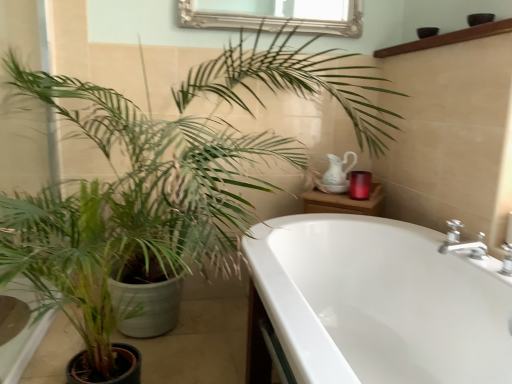
Question: Is brown wooden balustrade at upper right positioned beyond the bounds of green matte plant at left?

Choices:
 (A) no
 (B) yes

Answer: (B)

Question: Can you confirm if brown wooden balustrade at upper right is taller than green matte plant at left?

Choices:
 (A) yes
 (B) no

Answer: (B)

Question: Does brown wooden balustrade at upper right lie in front of green matte plant at left?

Choices:
 (A) no
 (B) yes

Answer: (A)

Question: Could you tell me if brown wooden balustrade at upper right is facing green matte plant at left?

Choices:
 (A) yes
 (B) no

Answer: (B)

Question: From the image's perspective, is brown wooden balustrade at upper right located above green matte plant at left?

Choices:
 (A) yes
 (B) no

Answer: (A)

Question: Is point (93, 251) positioned closer to the camera than point (328, 370)?

Choices:
 (A) farther
 (B) closer

Answer: (A)

Question: Is green matte plant at left wider or thinner than white glossy bathtub at lower right?

Choices:
 (A) wide
 (B) thin

Answer: (B)

Question: Looking at the image, does green matte plant at left seem bigger or smaller compared to white glossy bathtub at lower right?

Choices:
 (A) small
 (B) big

Answer: (A)

Question: Do you think green matte plant at left is within white glossy bathtub at lower right, or outside of it?

Choices:
 (A) outside
 (B) inside

Answer: (A)

Question: Is point (275, 288) closer or farther from the camera than point (10, 263)?

Choices:
 (A) closer
 (B) farther

Answer: (B)

Question: In the image, is white glossy bathtub at lower right positioned in front of or behind green matte plant at left?

Choices:
 (A) behind
 (B) front

Answer: (B)

Question: Looking at their shapes, would you say white glossy bathtub at lower right is wider or thinner than green matte plant at left?

Choices:
 (A) thin
 (B) wide

Answer: (B)

Question: In terms of size, does white glossy bathtub at lower right appear bigger or smaller than green matte plant at left?

Choices:
 (A) big
 (B) small

Answer: (A)

Question: From a real-world perspective, is white glossy bathtub at lower right physically located above or below brown wooden balustrade at upper right?

Choices:
 (A) below
 (B) above

Answer: (A)

Question: From their relative heights in the image, would you say white glossy bathtub at lower right is taller or shorter than brown wooden balustrade at upper right?

Choices:
 (A) short
 (B) tall

Answer: (B)